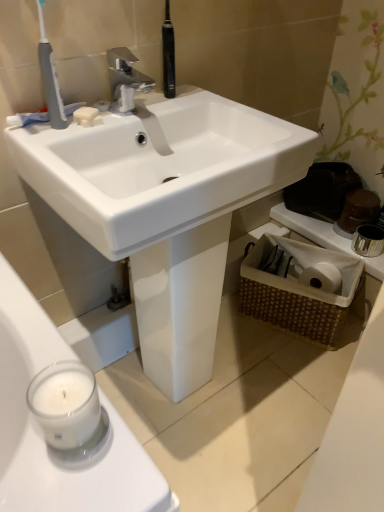
At what (x,y) coordinates should I click in order to perform the action: click on free spot to the left of silver metallic faucet at upper center. Please return your answer as a coordinate pair (x, y). Looking at the image, I should click on (79, 120).